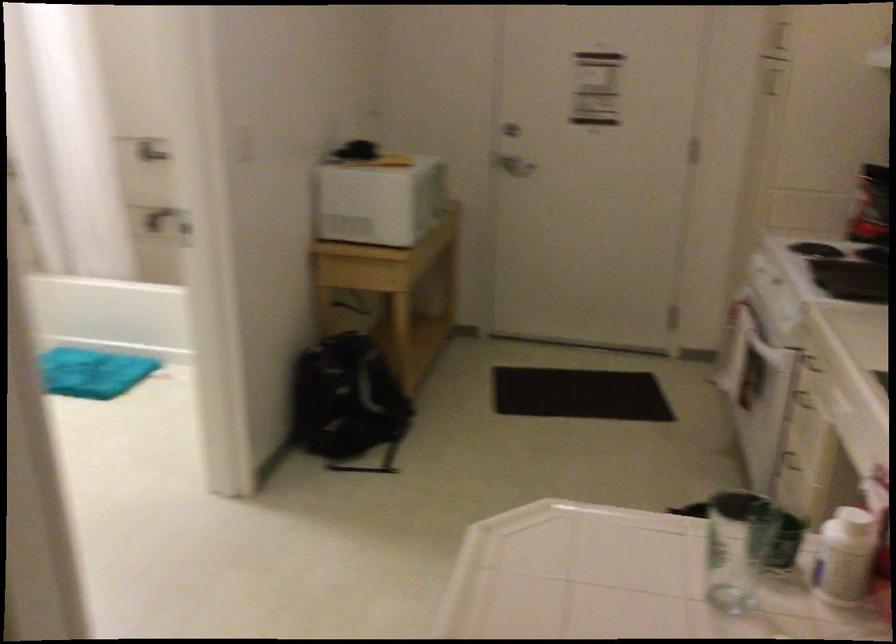
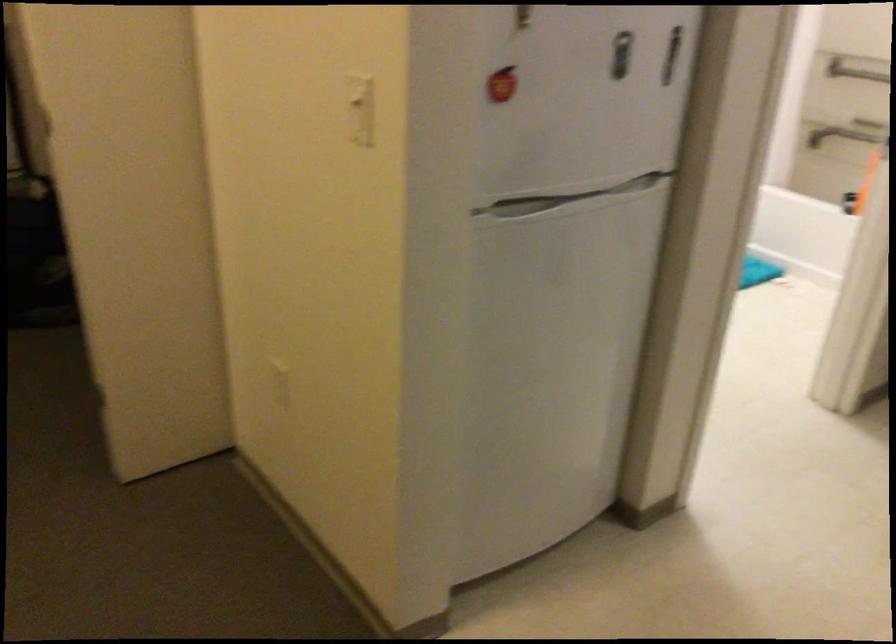
Question: The first image is from the beginning of the video and the second image is from the end. How did the camera likely rotate when shooting the video?

Choices:
 (A) Left
 (B) Right
 (C) Up
 (D) Down

Answer: (A)